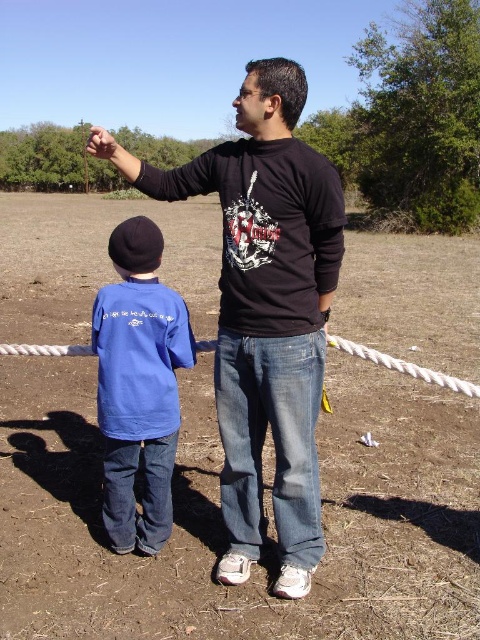
You are standing at the edge of the brown dirt field at center. If you walk straight ahead, will you stay on the field or step off it?

The brown dirt field at center is located at point (220, 518), so if you walk straight ahead from the edge, you would stay on the field since the coordinates suggest it is centered in the scene.

You are a photographer trying to capture a photo of the black cotton shirt at center while standing on the brown dirt field at center. Can you take the photo without moving from your current position?

The brown dirt field at center is further to the viewer than black cotton shirt at center, so you can take the photo without moving from your current position because the black cotton shirt at center is closer to you.